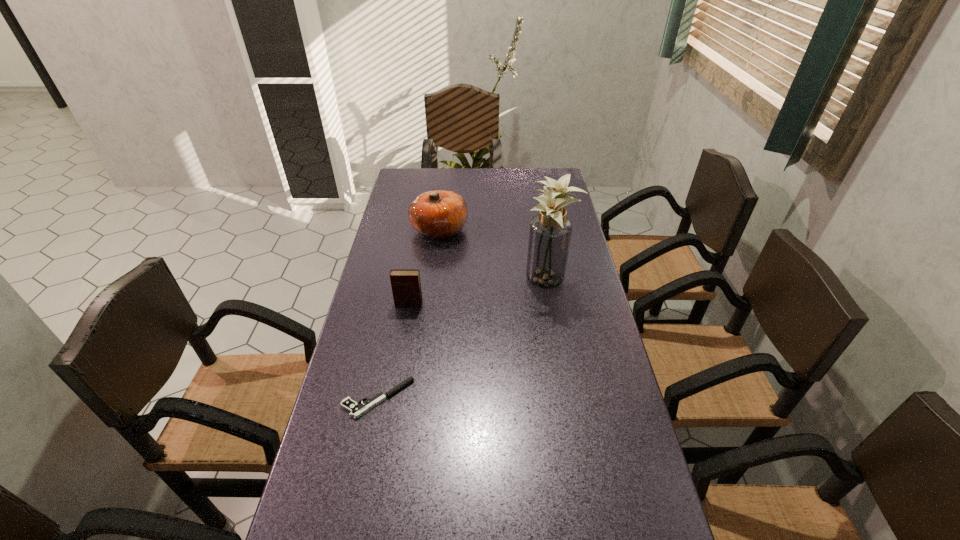
Locate an element on the screen. the tallest object is located at coordinates (550, 232).

Locate an element on the screen. flower arrangement is located at coordinates (550, 232).

The image size is (960, 540). Find the location of `the third shortest object`. the third shortest object is located at coordinates (437, 214).

The image size is (960, 540). Identify the location of pumpkin. (437, 214).

Where is `the third tallest object`? The image size is (960, 540). the third tallest object is located at coordinates (406, 287).

Locate an element on the screen. pistol is located at coordinates (356, 409).

You are a GUI agent. You are given a task and a screenshot of the screen. Output one action in this format:
    pyautogui.click(x=<x>, y=<y>)
    Task: Click on the shortest object
    Image resolution: width=960 pixels, height=540 pixels.
    Given the screenshot: What is the action you would take?
    pyautogui.click(x=356, y=409)

Where is `free space located on the front of the rightmost object`? free space located on the front of the rightmost object is located at coordinates (567, 407).

Locate an element on the screen. The image size is (960, 540). vacant region located on the back of the second tallest object is located at coordinates (444, 191).

Locate an element on the screen. vacant space located 0.110m on the front cover of the diary is located at coordinates (403, 335).